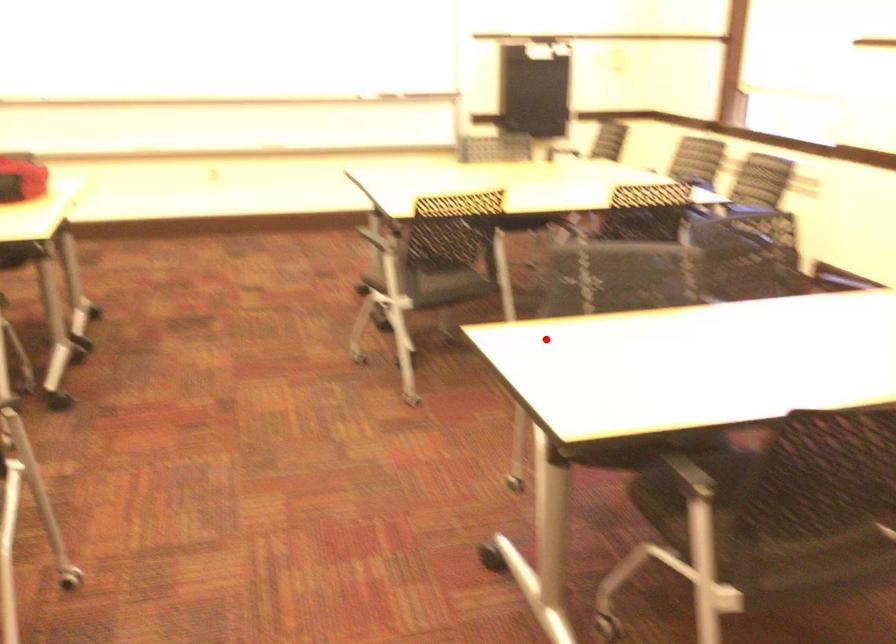
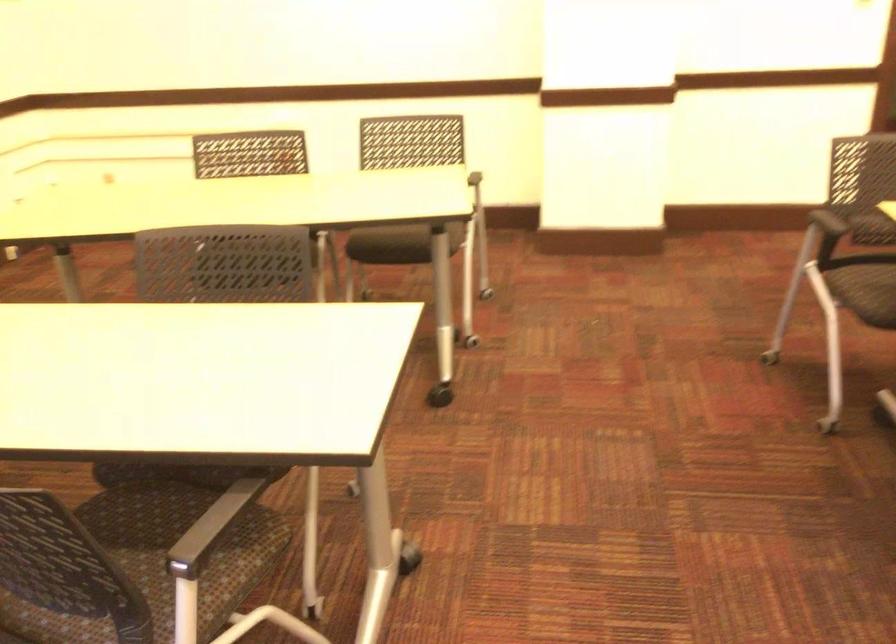
Question: I am providing you with two images of the same scene from different viewpoints. Given a red point in image1, look at the same physical point in image2. Is it:

Choices:
 (A) Closer to the viewpoint
 (B) Farther from the viewpoint

Answer: (A)